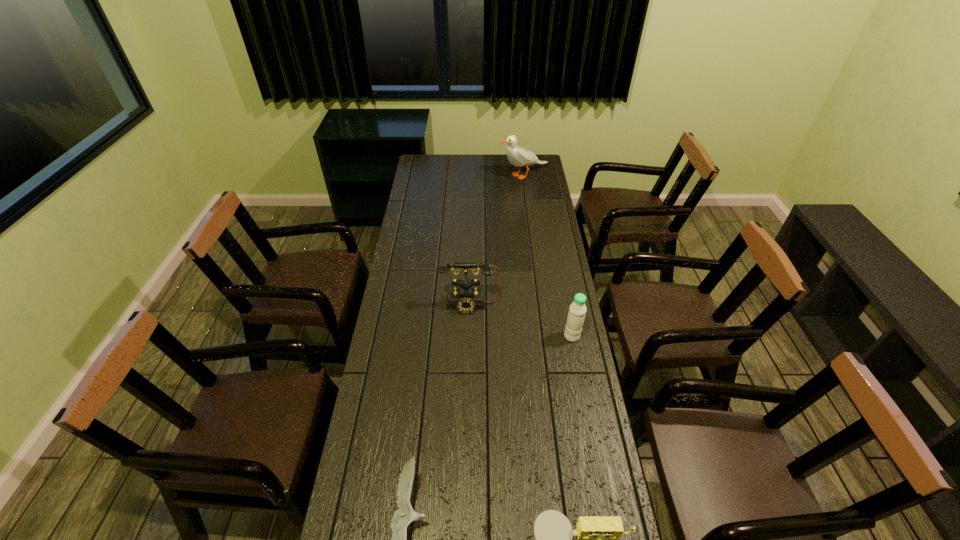
In order to click on gull situated at the right edge in this screenshot , I will do coord(518,156).

You are a GUI agent. You are given a task and a screenshot of the screen. Output one action in this format:
    pyautogui.click(x=<x>, y=<y>)
    Task: Click on the water bottle present at the right edge
    The width and height of the screenshot is (960, 540).
    Given the screenshot: What is the action you would take?
    pyautogui.click(x=577, y=310)

This screenshot has height=540, width=960. Identify the location of object that is at the far right corner. point(518,156).

What are the coordinates of `free location at the left edge` in the screenshot? It's located at (375, 514).

In the image, there is a desktop. Identify the location of free space at the right edge. The height and width of the screenshot is (540, 960). (535, 205).

Locate an element on the screen. Image resolution: width=960 pixels, height=540 pixels. vacant space at the far left corner of the desktop is located at coordinates (x=426, y=163).

Where is `free space between the second farthest object and the water bottle`? free space between the second farthest object and the water bottle is located at coordinates (521, 321).

You are a GUI agent. You are given a task and a screenshot of the screen. Output one action in this format:
    pyautogui.click(x=<x>, y=<y>)
    Task: Click on the vacant area between the second farthest object and the third farthest object
    This screenshot has width=960, height=540.
    Given the screenshot: What is the action you would take?
    pyautogui.click(x=521, y=321)

Locate an element on the screen. The height and width of the screenshot is (540, 960). unoccupied area between the taller gull and the water bottle is located at coordinates (548, 255).

The height and width of the screenshot is (540, 960). I want to click on the third closest object to the telephone, so click(596, 537).